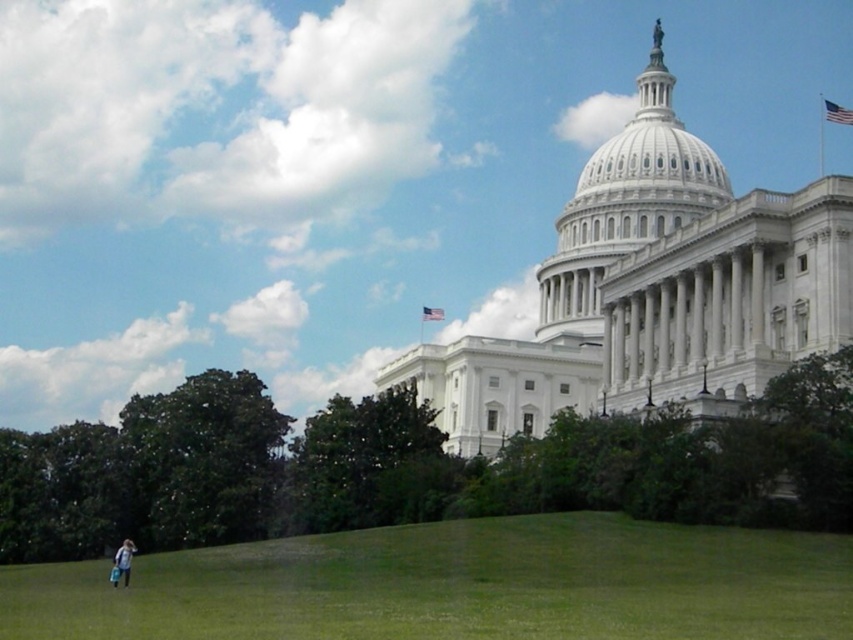
Locate an element on the screen. green grassy hill at lower left is located at coordinates (457, 586).

Between point (428, 621) and point (122, 572), which one is positioned behind?

Point (122, 572)

This screenshot has width=853, height=640. I want to click on green grassy hill at lower left, so click(x=457, y=586).